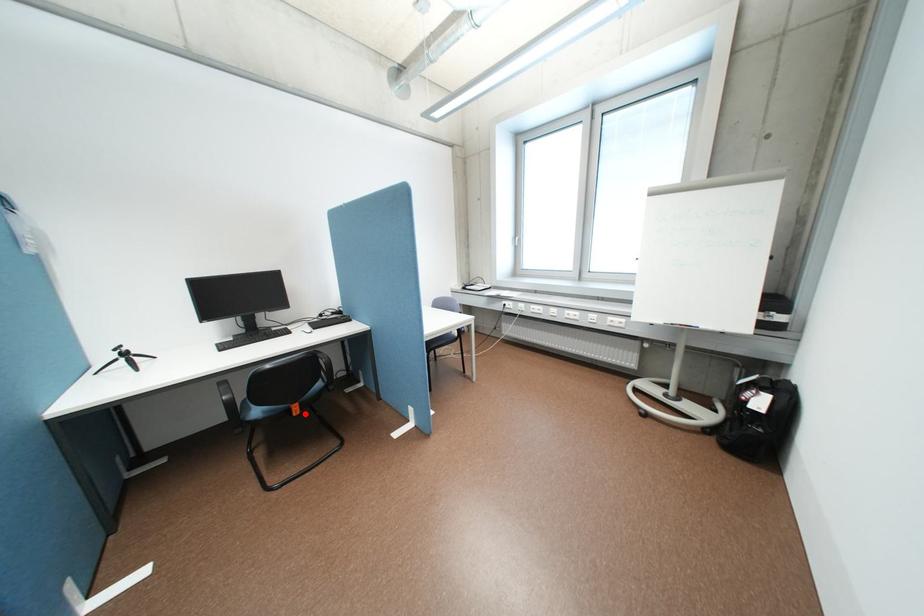
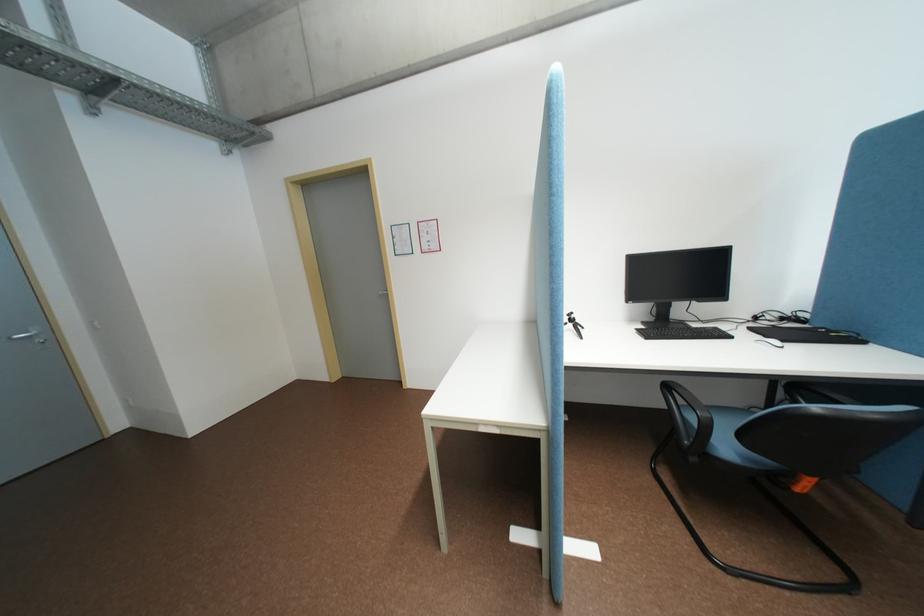
The point at the highlighted location is marked in the first image. Where is the corresponding point in the second image?

(808, 488)